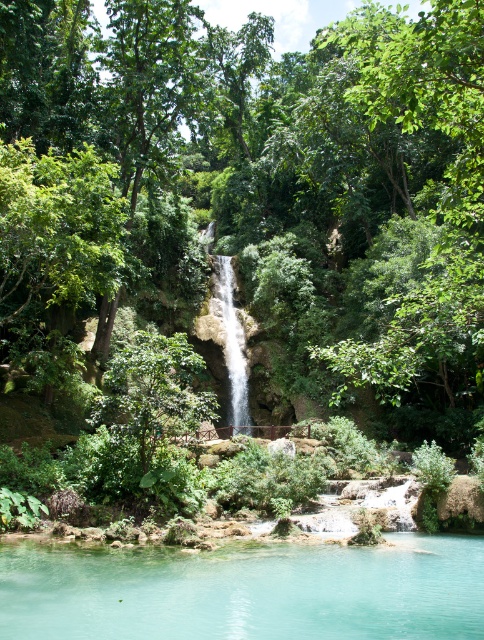
You are a photographer planning to capture the turquoise clear water at center and the translucent glass waterfall at center in a single frame. Based on their widths, which object should you focus on to ensure both are fully visible in your shot?

The turquoise clear water at center is wider than the translucent glass waterfall at center, so focusing on the wider turquoise clear water at center would ensure both are fully visible in the frame.

You are standing at the base of the waterfall and want to reach a hidden treasure located at point (437, 579). There is an obstacle at point (229, 300). Can you safely navigate around the obstacle to reach the treasure?

Point (437, 579) is in front of point (229, 300), so you can safely navigate around the obstacle at point (229, 300) to reach the treasure at point (437, 579).

You are a photographer planning to capture the turquoise clear water at center and the translucent glass waterfall at center in a single shot. Based on their sizes, which one should you focus on to ensure both are visible without cropping?

The turquoise clear water at center has a smaller size compared to the translucent glass waterfall at center, so you should focus on the larger translucent glass waterfall at center to ensure both are visible without cropping.